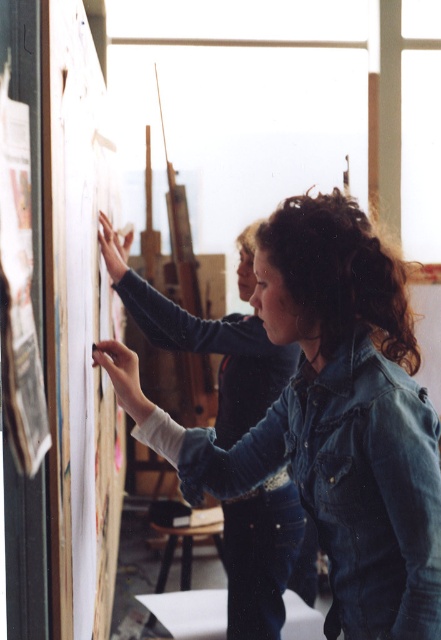
Who is higher up, denim jacket at lower right or denim jacket at upper center?

denim jacket at upper center

Does point (357, 611) lie behind point (172, 310)?

No, (357, 611) is in front of (172, 310).

This screenshot has width=441, height=640. What do you see at coordinates (348, 483) in the screenshot? I see `denim jacket at lower right` at bounding box center [348, 483].

Find the location of `denim jacket at lower right`. denim jacket at lower right is located at coordinates (348, 483).

Which is below, wooden board at left or denim jacket at upper center?

denim jacket at upper center is lower down.

Where is `wooden board at left`? The width and height of the screenshot is (441, 640). wooden board at left is located at coordinates (78, 324).

At what (x,y) coordinates should I click in order to perform the action: click on wooden board at left. Please return your answer as a coordinate pair (x, y). Image resolution: width=441 pixels, height=640 pixels. Looking at the image, I should click on (78, 324).

Does denim jacket at lower right appear over wooden board at left?

No.

Which of these two, denim jacket at lower right or wooden board at left, stands taller?

wooden board at left

Where is `denim jacket at lower right`? denim jacket at lower right is located at coordinates (348, 483).